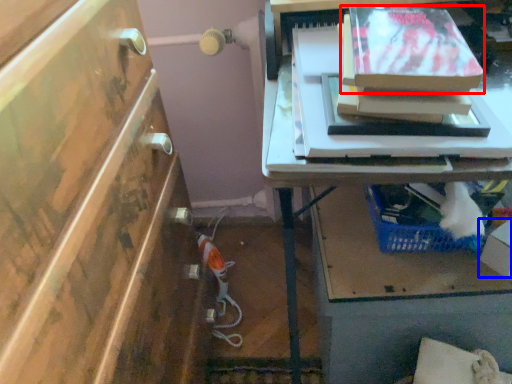
Question: Which object appears farthest to the camera in this image, storage box (highlighted by a red box) or box (highlighted by a blue box)?

Choices:
 (A) storage box
 (B) box

Answer: (B)